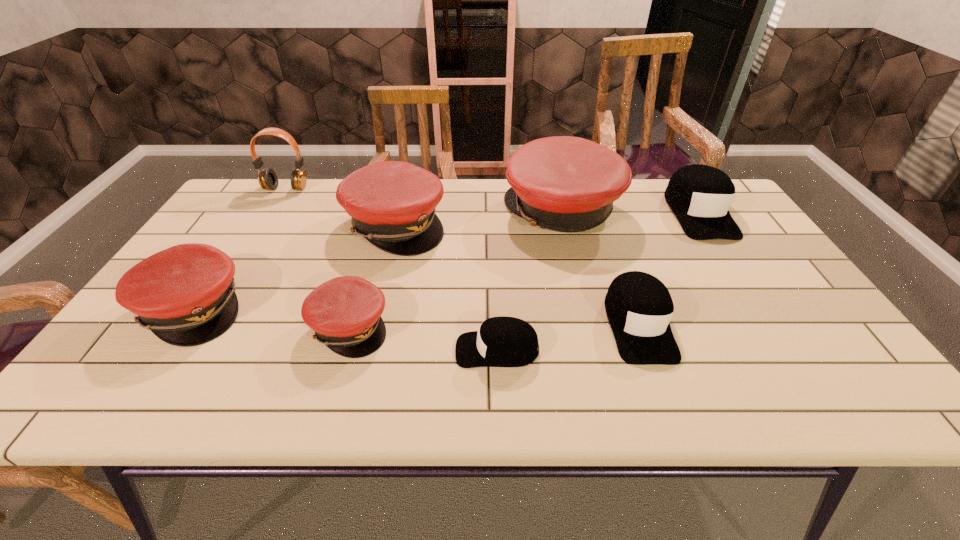
Point out which red cap is positioned as the nearest to the smallest red cap. Please provide its 2D coordinates. Your answer should be formatted as a tuple, i.e. [(x, y)], where the tuple contains the x and y coordinates of a point satisfying the conditions above.

[(392, 204)]

Image resolution: width=960 pixels, height=540 pixels. What are the coordinates of `the second closest red cap to the smallest red cap` in the screenshot? It's located at (185, 295).

Locate which black cap ranks second in proximity to the second biggest red cap. Please provide its 2D coordinates. Your answer should be formatted as a tuple, i.e. [(x, y)], where the tuple contains the x and y coordinates of a point satisfying the conditions above.

[(639, 307)]

Where is `black cap that stands as the closest to the smallest black cap`? black cap that stands as the closest to the smallest black cap is located at coordinates (639, 307).

What are the coordinates of `vacant space that satisfies the following two spatial constraints: 1. on the front-facing side of the rightmost black cap; 2. on the front-facing side of the second biggest red cap` in the screenshot? It's located at (707, 225).

Image resolution: width=960 pixels, height=540 pixels. In order to click on vacant area that satisfies the following two spatial constraints: 1. on the front-facing side of the rightmost object; 2. on the front-facing side of the smallest red cap in this screenshot , I will do `click(773, 327)`.

You are a GUI agent. You are given a task and a screenshot of the screen. Output one action in this format:
    pyautogui.click(x=<x>, y=<y>)
    Task: Click on the free location that satisfies the following two spatial constraints: 1. on the front-facing side of the second black cap from right to left; 2. on the front-facing side of the shortest object
    
    Given the screenshot: What is the action you would take?
    pyautogui.click(x=647, y=350)